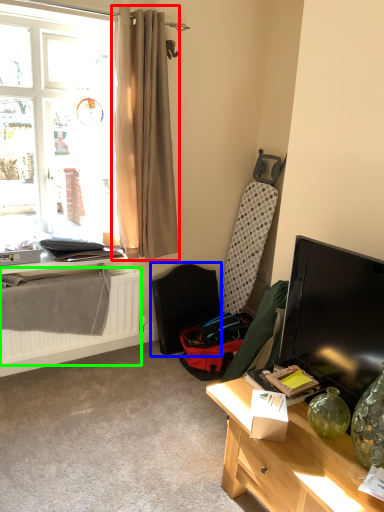
Question: Considering the real-world distances, which object is closest to curtain (highlighted by a red box)? folding chair (highlighted by a blue box) or radiator (highlighted by a green box).

Choices:
 (A) folding chair
 (B) radiator

Answer: (A)